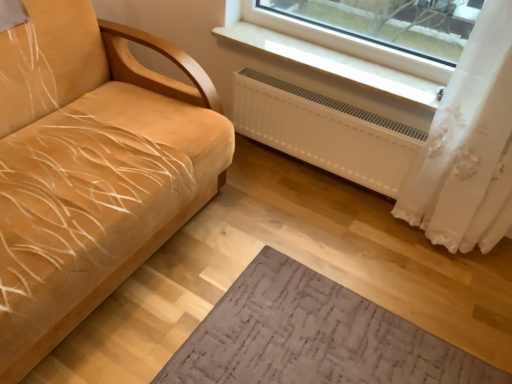
Where is `free space in front of white sheer curtain at right`? free space in front of white sheer curtain at right is located at coordinates (437, 293).